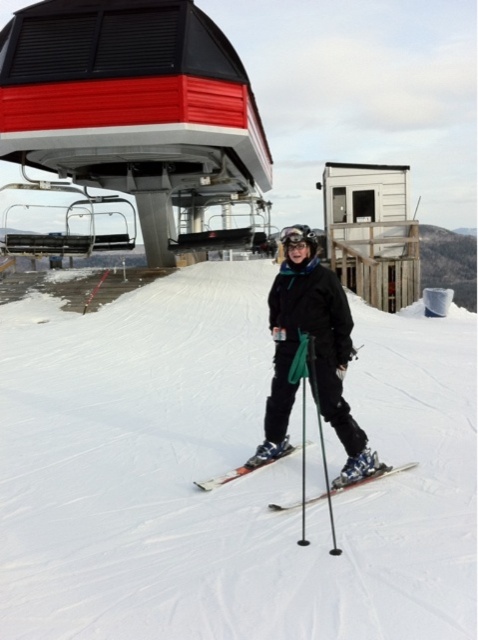
Question: Which of the following is the farthest from the observer?

Choices:
 (A) pyautogui.click(x=224, y=481)
 (B) pyautogui.click(x=236, y=470)
 (C) pyautogui.click(x=381, y=468)

Answer: (B)

Question: Where is shiny metallic skis at center located in relation to shiny metallic ski at center in the image?

Choices:
 (A) above
 (B) below

Answer: (A)

Question: Which point appears closest to the camera in this image?

Choices:
 (A) (268, 420)
 (B) (219, 365)
 (C) (324, 477)

Answer: (C)

Question: Which of the following is the farthest from the observer?

Choices:
 (A) (228, 472)
 (B) (327, 349)

Answer: (A)

Question: In this image, where is orange metallic skis at center located relative to shiny metallic ski at center?

Choices:
 (A) right
 (B) left

Answer: (B)

Question: Is orange metallic skis at center to the left of shiny metallic ski at center from the viewer's perspective?

Choices:
 (A) no
 (B) yes

Answer: (B)